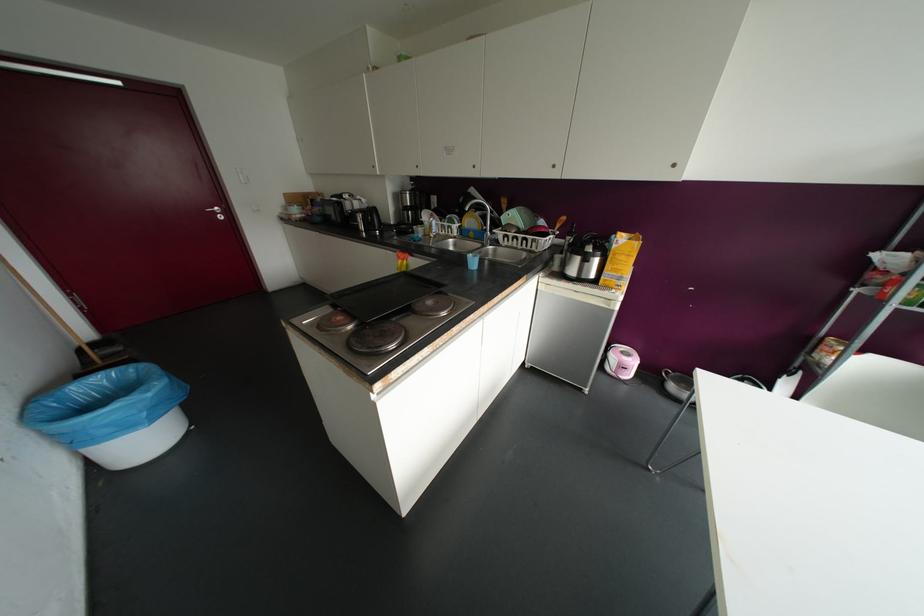
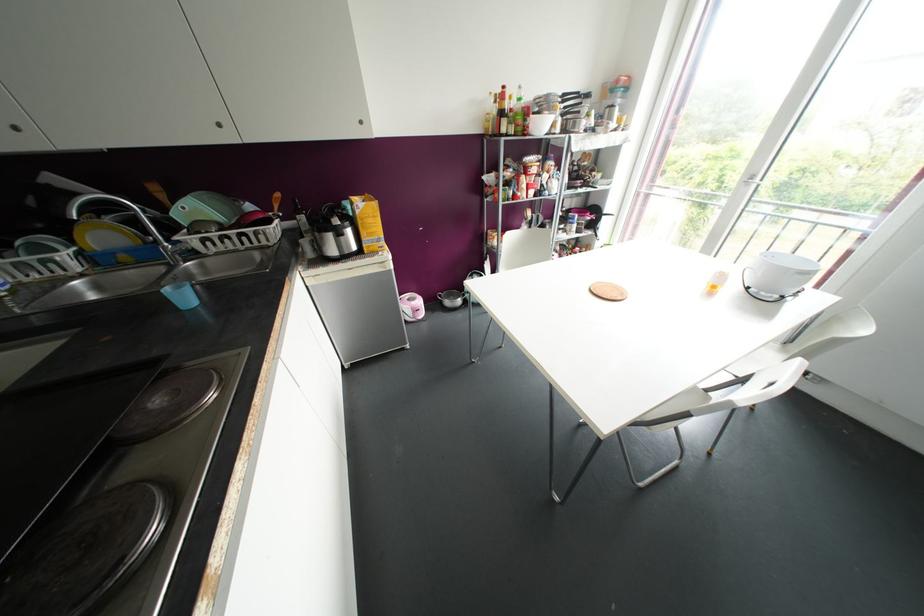
Where in the second image is the point corresponding to [553,166] from the first image?

(219, 124)